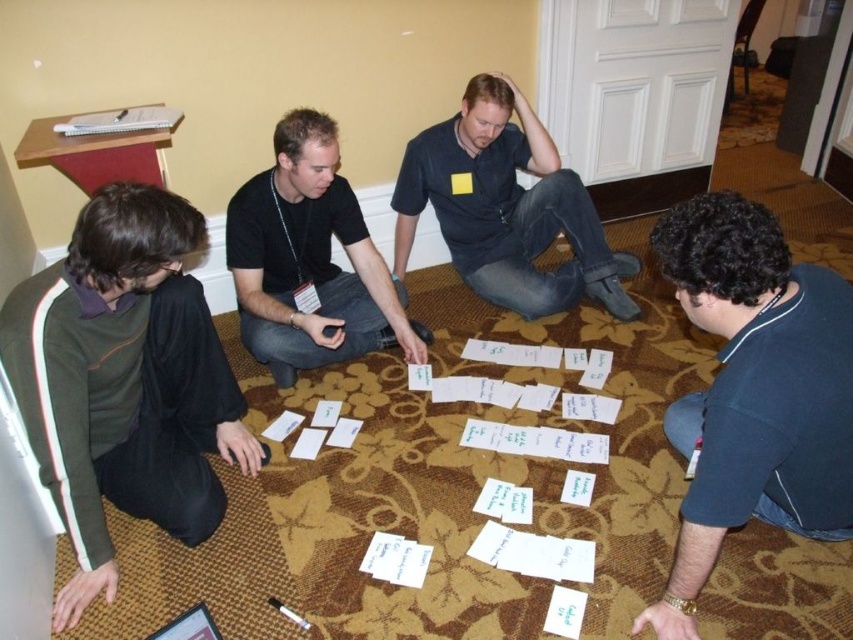
Measure the distance between point (502, 83) and camera.

Point (502, 83) is 8.21 feet from camera.

The width and height of the screenshot is (853, 640). What are the coordinates of `dark blue shirt at center` in the screenshot? It's located at (506, 208).

Is point (450, 445) behind point (280, 227)?

That is False.

Is point (329, 378) closer to viewer compared to point (331, 195)?

That is False.

Is point (447, 472) positioned after point (322, 221)?

No, (447, 472) is in front of (322, 221).

Image resolution: width=853 pixels, height=640 pixels. Find the location of `white paper at center`. white paper at center is located at coordinates (426, 515).

Does dark blue shirt at lower right have a greater height compared to black cotton shirt at center?

Yes, dark blue shirt at lower right is taller than black cotton shirt at center.

Is point (700, 401) positioned before point (352, 296)?

Yes.

Consider the image. Measure the distance between dark blue shirt at lower right and camera.

The distance of dark blue shirt at lower right from camera is 4.06 feet.

This screenshot has width=853, height=640. I want to click on dark blue shirt at lower right, so [x=753, y=390].